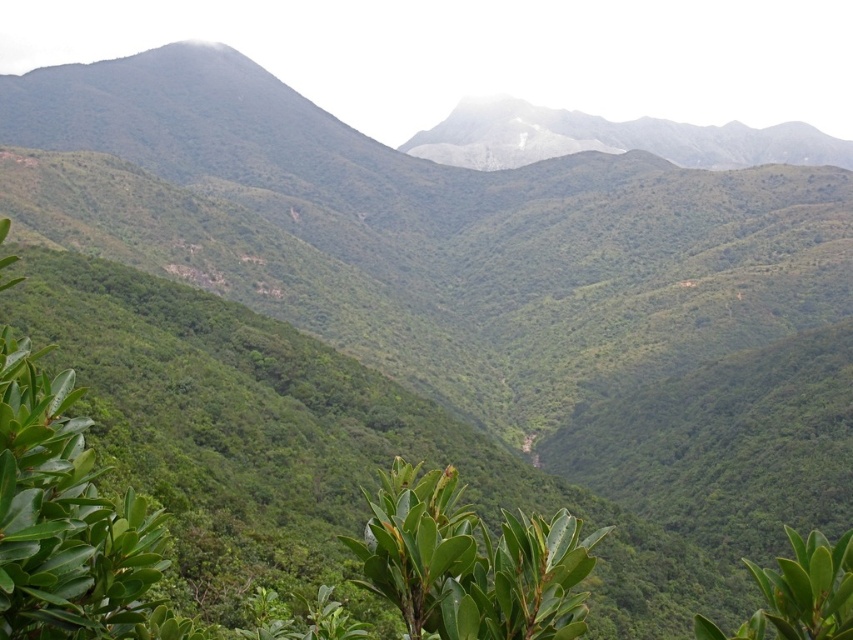
Question: Which of the following is the closest to the observer?

Choices:
 (A) green leafy tree at lower right
 (B) gray/smooth mountain at upper center

Answer: (A)

Question: Among these points, which one is nearest to the camera?

Choices:
 (A) (451, 493)
 (B) (701, 166)
 (C) (0, 403)
 (D) (820, 557)

Answer: (D)

Question: Does gray/smooth mountain at upper center have a larger size compared to green leafy tree at lower right?

Choices:
 (A) no
 (B) yes

Answer: (B)

Question: Observing the image, what is the correct spatial positioning of green leafy plant at center in reference to gray/smooth mountain at upper center?

Choices:
 (A) above
 (B) below

Answer: (B)

Question: Does green leafy shrub at left have a lesser width compared to gray/smooth mountain at upper center?

Choices:
 (A) yes
 (B) no

Answer: (A)

Question: Which is farther from the green leafy plant at center?

Choices:
 (A) green leafy tree at lower right
 (B) green leafy shrub at left
 (C) gray/smooth mountain at upper center

Answer: (C)